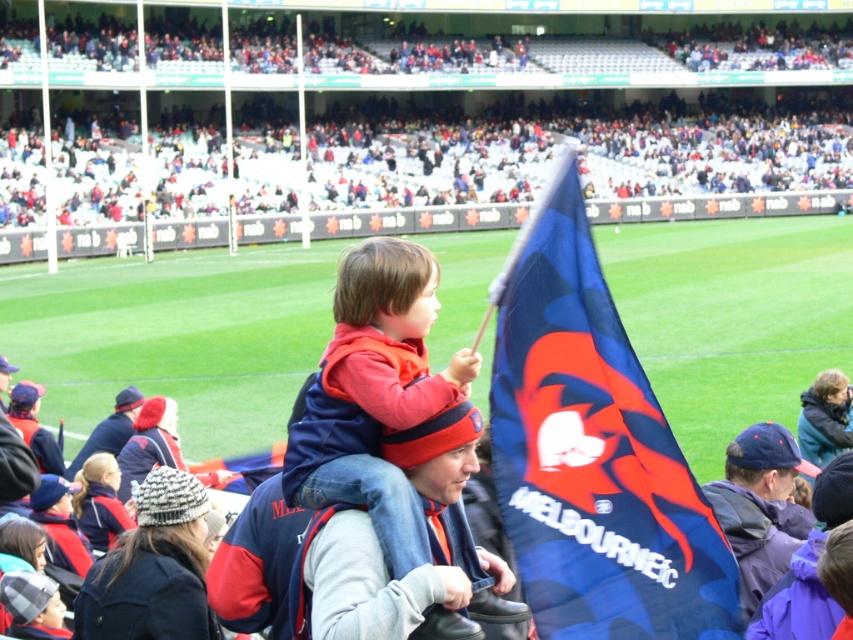
Question: Is blue fabric flag at center positioned before red fleece jacket at center?

Choices:
 (A) no
 (B) yes

Answer: (B)

Question: Where is red fleece jacket at center located in relation to dark blue knit cap at center in the image?

Choices:
 (A) below
 (B) above

Answer: (B)

Question: Which object is farther from the camera taking this photo?

Choices:
 (A) dark blue knit cap at center
 (B) dark blue jacket at center
 (C) red fleece jacket at center
 (D) blue fabric flag at center

Answer: (B)

Question: Which is farther from the dark blue jacket at center?

Choices:
 (A) dark blue knit cap at center
 (B) blue fabric flag at center

Answer: (B)

Question: Does red fleece jacket at center appear on the right side of dark blue jacket at center?

Choices:
 (A) no
 (B) yes

Answer: (B)

Question: Which object is the farthest from the dark blue knit cap at center?

Choices:
 (A) dark blue jacket at center
 (B) blue fabric flag at center
 (C) red fleece jacket at center

Answer: (A)